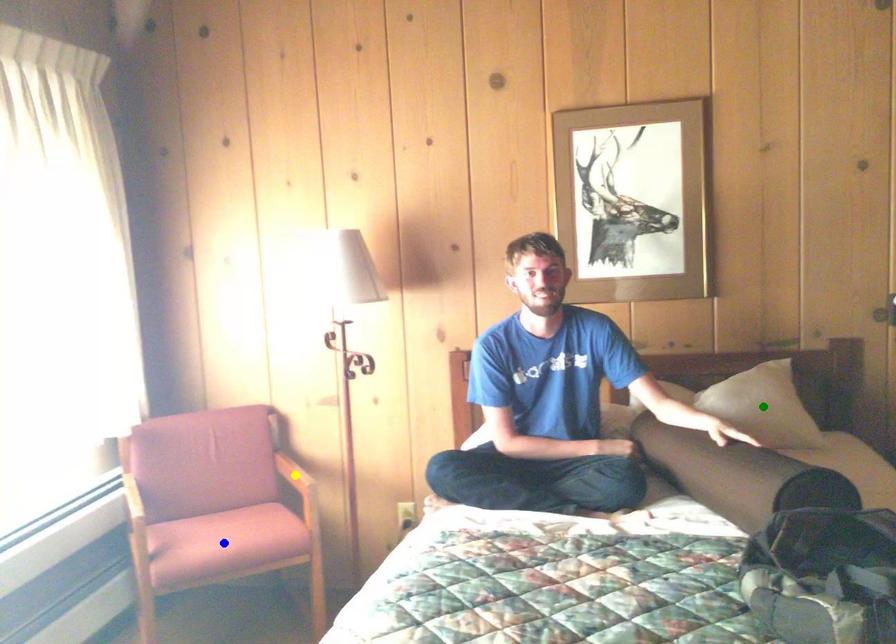
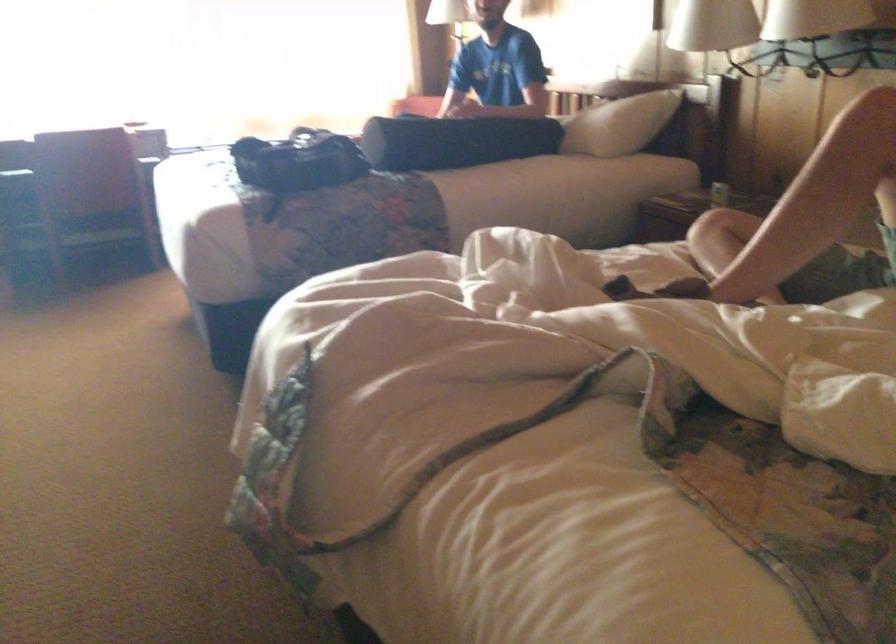
I am providing you with two images of the same scene from different viewpoints. Three points are marked in image1. Which point corresponds to a part or object that is occluded in image2?In image1, three points are marked. Which of them correspond to a part or object that is occluded in image2?Among the three points shown in image1, which one corresponds to a part or object that is no longer visible due to occlusion in image2?

yellow point, blue point, green point cannot be seen in image2.